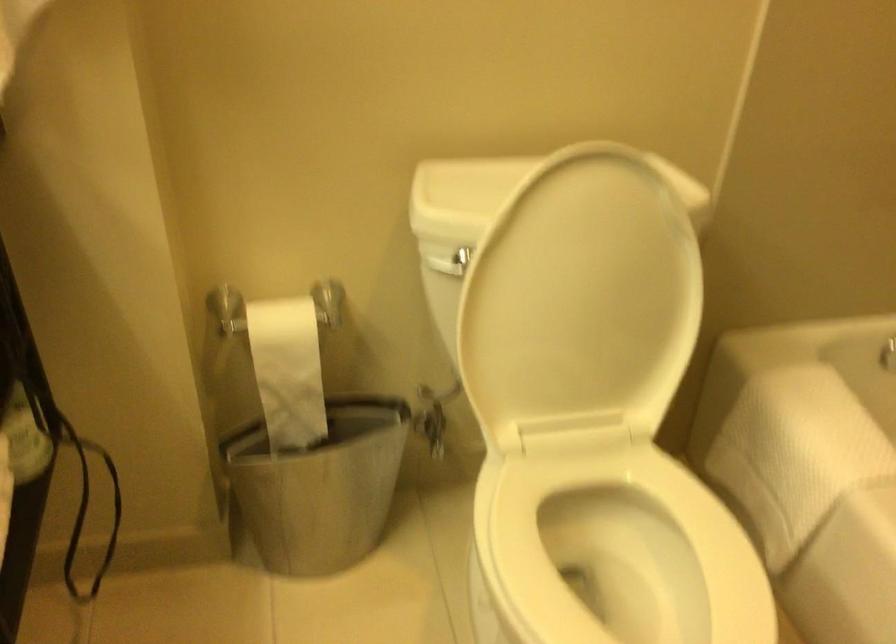
Identify the location of metal trash can. (319, 487).